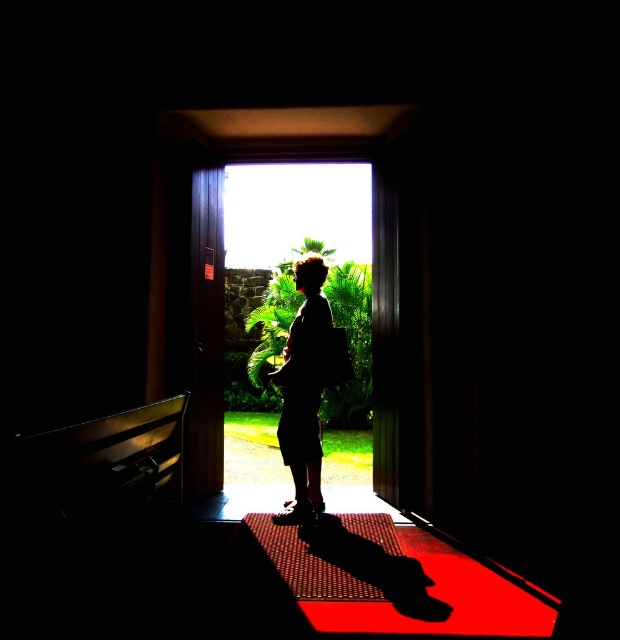
You are a delivery person trying to step onto the rubber textured mat at center while carrying a large box. The box is taller than your head. Can you safely walk through the transparent glass door at center without hitting your head?

The transparent glass door at center has a greater height compared to the rubber textured mat at center. Since the door is taller, you can safely walk through the transparent glass door at center with the box taller than your head without hitting your head.

You are a painter who wants to paint the scene. You need to know which object is taller between the wooden door at center and the rubber textured mat at center. Which one is taller?

The wooden door at center is taller than the rubber textured mat at center.